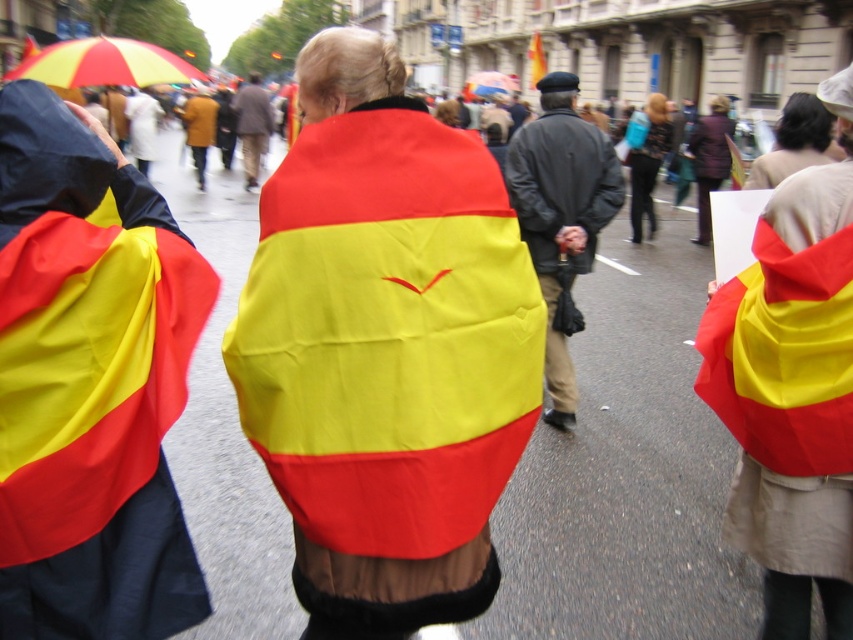
You are a photographer standing at the back of the crowd. You want to take a photo of the leather jacket at center and the dark gray matte jacket at center. Can you fit both jackets in your camera frame if your camera has a minimum distance requirement of 4 inches between subjects to focus properly?

The leather jacket at center is 3.69 inches from dark gray matte jacket at center. Since the distance between them is less than the camera requirement of 4 inches, the photographer cannot focus properly on both jackets simultaneously.

You are a photographer trying to capture a closeup of the two jackets on the person at the center of the image. The leather jacket at center and the dark gray matte jacket at center. Which jacket would you need to adjust your camera focus for first if you want to focus on the narrower one?

The leather jacket at center has a smaller width than the dark gray matte jacket at center, so you should focus on the leather jacket at center first since it is narrower.

You are a photographer standing at the origin point in this street scene. You want to take a photo of both the point at (508, 241) and the point at (556, 161). Which point should you focus on first to ensure both are in the frame?

You should focus on point (508, 241) first because it is closer to the viewer than point (556, 161), allowing both points to be captured in the frame.